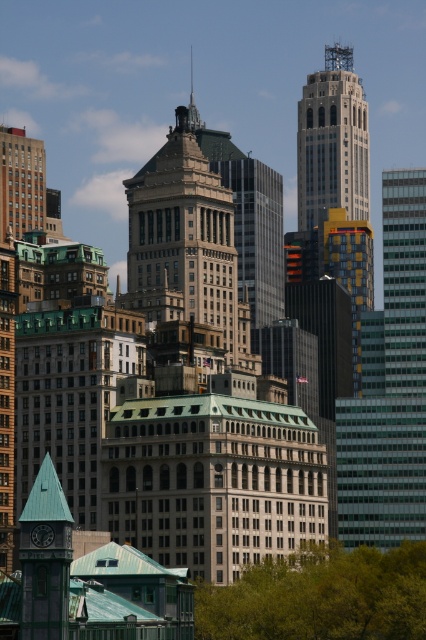
You are standing at a viewpoint overlooking the city and want to take a photo that includes both the light gray concrete skyscraper at upper center and the green matte clock tower at lower left. Based on their positions, which building should you position on the right side of your camera frame to ensure both are visible?

You should position the light gray concrete skyscraper at upper center on the right side of your camera frame because it is already located to the right of the green matte clock tower at lower left.

You are a city planner reviewing the urban skyline. You notice the light gray concrete skyscraper at upper center and the shiny silver spire at upper center. How far apart are these two structures in meters?

The light gray concrete skyscraper at upper center and shiny silver spire at upper center are 54.14 meters apart.